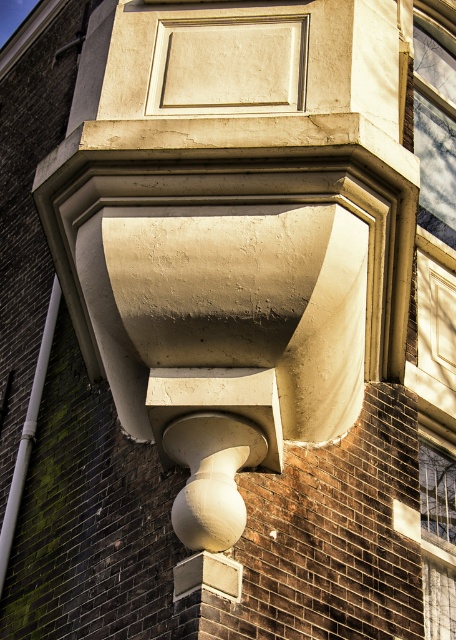
You are a window cleaner standing on the matte concrete balcony at center. You need to clean the smooth glass window at upper right. Can you reach it from your current position if your longest cleaning pole extends 12 feet?

The matte concrete balcony at center is 14.20 feet away from the smooth glass window at upper right. Since the cleaning pole only extends 12 feet, you cannot reach the smooth glass window at upper right from the matte concrete balcony at center.

You are an architect reviewing the bay window structure. You notice two points marked on the image at coordinates point [102,260] and point [451,156]. Based on the structure shown, which point is positioned closer to the viewer?

Point [102,260] is closer to the viewer than point [451,156].

You are standing outside the building and want to look through the smooth glass window at upper right. To do so, you need to climb onto the matte concrete balcony at center. Is the balcony positioned in a way that allows you to reach the window?

The matte concrete balcony at center is below the smooth glass window at upper right, so yes, you can climb onto the matte concrete balcony at center to reach the smooth glass window at upper right.